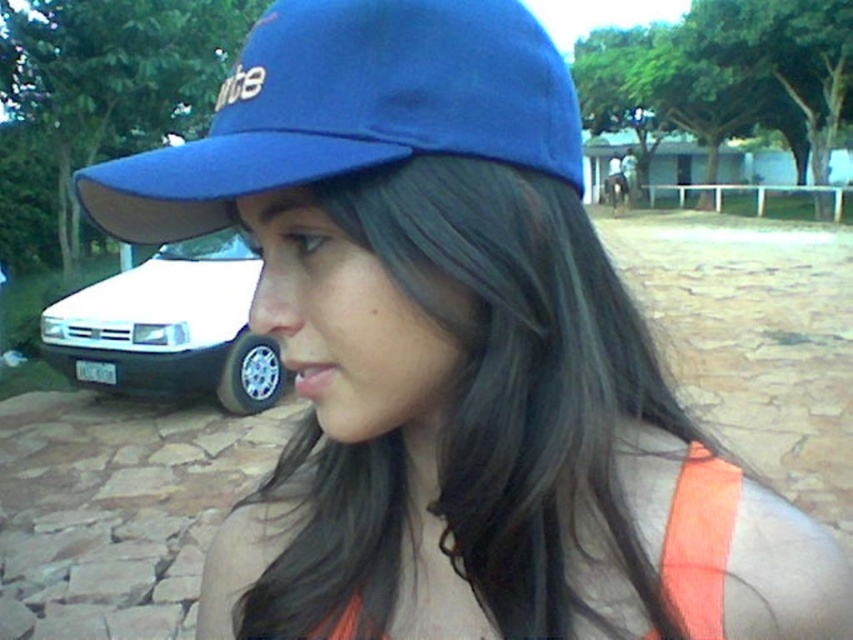
Which is behind, point (344, 166) or point (625, 168)?

Point (625, 168)

Between point (511, 147) and point (630, 156), which one is positioned behind?

Point (630, 156)

Find the location of a particular element. The width and height of the screenshot is (853, 640). blue fabric baseball cap at upper left is located at coordinates (351, 109).

Who is more forward, (112,284) or (622,177)?

Positioned in front is point (112,284).

Describe the element at coordinates (170, 326) in the screenshot. This screenshot has width=853, height=640. I see `white glossy car at left` at that location.

Where is `white glossy car at left`? white glossy car at left is located at coordinates (170, 326).

Is point (447, 99) positioned behind point (683, 506)?

That is False.

Between blue fabric baseball cap at upper left and orange fabric safety vest at lower right, which one is positioned lower?

Positioned lower is orange fabric safety vest at lower right.

Who is more forward, (x=334, y=8) or (x=711, y=556)?

Positioned in front is point (x=334, y=8).

At what (x,y) coordinates should I click in order to perform the action: click on blue fabric baseball cap at upper left. Please return your answer as a coordinate pair (x, y). Looking at the image, I should click on (351, 109).